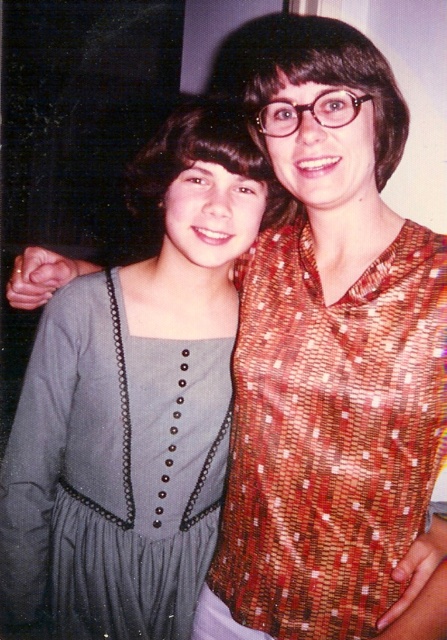
You are a photographer trying to adjust the lighting for a photo shoot. You notice two main clothing items in the frame, the shiny brown blouse at center and the gray textured fabric dress at center. Which clothing item is positioned to the right side of the other?

The shiny brown blouse at center is positioned to the right of the gray textured fabric dress at center.